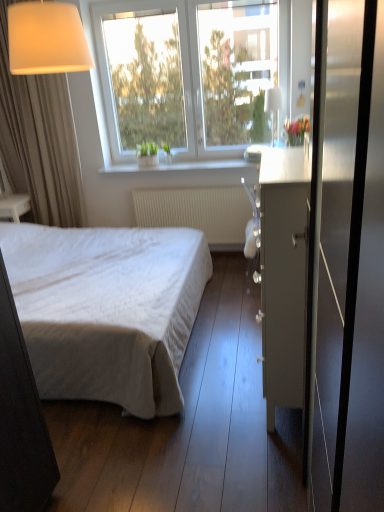
What is the approximate width of metallic glass screen door at right?

It is 5.51 inches.

Identify the location of transparent glass window at upper center. The width and height of the screenshot is (384, 512). (190, 65).

Identify the location of white quilted fabric bed at center. This screenshot has width=384, height=512. (107, 310).

Describe the element at coordinates (107, 310) in the screenshot. Image resolution: width=384 pixels, height=512 pixels. I see `white quilted fabric bed at center` at that location.

What do you see at coordinates (183, 167) in the screenshot?
I see `white smooth window sill at upper center` at bounding box center [183, 167].

What do you see at coordinates (198, 212) in the screenshot?
I see `white textured radiator at center` at bounding box center [198, 212].

Identify the location of transparent glass lamp at upper center, the second lamp viewed from the left. (272, 104).

Between matte white lampshade at upper left, acting as the 1th lamp starting from the front, and metallic glass screen door at right, which one appears on the left side from the viewer's perspective?

matte white lampshade at upper left, acting as the 1th lamp starting from the front, is more to the left.

From the picture: From the image's perspective, which one is positioned lower, matte white lampshade at upper left, which ranks as the 2th lamp in right-to-left order, or metallic glass screen door at right?

metallic glass screen door at right, from the image's perspective.

Is matte white lampshade at upper left, which is counted as the 2th lamp, starting from the back, thinner than metallic glass screen door at right?

No.

Is metallic glass screen door at right beside white textured radiator at center?

metallic glass screen door at right and white textured radiator at center are not in contact.

You are a GUI agent. You are given a task and a screenshot of the screen. Output one action in this format:
    pyautogui.click(x=<x>, y=<y>)
    Task: Click on the screen door that is in front of the white textured radiator at center
    
    Given the screenshot: What is the action you would take?
    pyautogui.click(x=359, y=212)

Which object is further away from the camera taking this photo, metallic glass screen door at right or white textured radiator at center?

Positioned behind is white textured radiator at center.

Which object is positioned more to the right, metallic glass screen door at right or white textured radiator at center?

metallic glass screen door at right is more to the right.

Looking at this image, from the image's perspective, would you say white textured radiator at center is shown under matte white lampshade at upper left, acting as the 1th lamp starting from the front?

Correct, white textured radiator at center appears lower than matte white lampshade at upper left, acting as the 1th lamp starting from the front, in the image.

From a real-world perspective, is white textured radiator at center located higher than matte white lampshade at upper left, which ranks as the 2th lamp in right-to-left order?

No.

What's the angular difference between white textured radiator at center and matte white lampshade at upper left, acting as the 1th lamp starting from the front,'s facing directions?

The facing directions of white textured radiator at center and matte white lampshade at upper left, acting as the 1th lamp starting from the front, are 11.9 degrees apart.

Between point (219, 218) and point (82, 39), which one is positioned behind?

The point (219, 218) is more distant.

Considering the sizes of transparent glass window at upper center and white smooth window sill at upper center in the image, is transparent glass window at upper center taller or shorter than white smooth window sill at upper center?

Clearly, transparent glass window at upper center is taller compared to white smooth window sill at upper center.

Does transparent glass window at upper center have a lesser width compared to white smooth window sill at upper center?

Correct, the width of transparent glass window at upper center is less than that of white smooth window sill at upper center.

Is point (195, 20) behind point (202, 170)?

No, (195, 20) is in front of (202, 170).

Is transparent glass window at upper center turned away from white smooth window sill at upper center?

No, white smooth window sill at upper center is not at the back of transparent glass window at upper center.

Is matte gray cabinet at center-right to the left or to the right of white quilted fabric bed at center in the image?

Clearly, matte gray cabinet at center-right is on the right of white quilted fabric bed at center in the image.

Measure the distance from matte gray cabinet at center-right to white quilted fabric bed at center.

matte gray cabinet at center-right and white quilted fabric bed at center are 1.04 meters apart.

Would you say matte gray cabinet at center-right contains white quilted fabric bed at center?

That's incorrect, white quilted fabric bed at center is not inside matte gray cabinet at center-right.

Which object is further away from the camera, matte gray cabinet at center-right or white quilted fabric bed at center?

Positioned behind is white quilted fabric bed at center.

How different are the orientations of matte gray cabinet at center-right and white smooth window sill at upper center in degrees?

They differ by 91 degrees in their facing directions.

Is point (278, 234) closer or farther from the camera than point (201, 169)?

Point (278, 234).

Between matte gray cabinet at center-right and white smooth window sill at upper center, which one has smaller size?

With smaller size is white smooth window sill at upper center.

Is matte gray cabinet at center-right in front of or behind white smooth window sill at upper center in the image?

Visually, matte gray cabinet at center-right is located in front of white smooth window sill at upper center.

From the image's perspective, which object appears higher, white textured radiator at center or beige fabric curtain at left?

From the image's view, beige fabric curtain at left is above.

Is white textured radiator at center thinner than beige fabric curtain at left?

Correct, the width of white textured radiator at center is less than that of beige fabric curtain at left.

Considering the relative sizes of white textured radiator at center and beige fabric curtain at left in the image provided, is white textured radiator at center taller than beige fabric curtain at left?

No, white textured radiator at center is not taller than beige fabric curtain at left.

Which is farther from the camera, (236, 207) or (37, 119)?

Positioned behind is point (236, 207).

Where is `screen door to the right of matte white lampshade at upper left, acting as the 1th lamp starting from the front`? The height and width of the screenshot is (512, 384). screen door to the right of matte white lampshade at upper left, acting as the 1th lamp starting from the front is located at coordinates (359, 212).

Where is `radiator above the metallic glass screen door at right (from the image's perspective)`? radiator above the metallic glass screen door at right (from the image's perspective) is located at coordinates pyautogui.click(x=198, y=212).

Based on their spatial positions, is metallic glass screen door at right or white quilted fabric bed at center closer to white textured radiator at center?

The object closer to white textured radiator at center is white quilted fabric bed at center.

Estimate the real-world distances between objects in this image. Which object is closer to transparent glass lamp at upper center, the second lamp viewed from the left, matte white lampshade at upper left, acting as the 1th lamp starting from the front, or beige fabric curtain at left?

Among the two, matte white lampshade at upper left, acting as the 1th lamp starting from the front, is located nearer to transparent glass lamp at upper center, the second lamp viewed from the left.

From the picture: Which object lies further to the anchor point transparent glass window at upper center, white quilted fabric bed at center or matte gray cabinet at center-right?

Based on the image, matte gray cabinet at center-right appears to be further to transparent glass window at upper center.

Which object lies nearer to the anchor point white smooth window sill at upper center, white quilted fabric bed at center or matte gray cabinet at center-right?

white quilted fabric bed at center.

Which object lies further to the anchor point beige fabric curtain at left, matte white lampshade at upper left, which is counted as the 2th lamp, starting from the back, or matte gray cabinet at center-right?

The object further to beige fabric curtain at left is matte gray cabinet at center-right.

Considering their positions, is metallic glass screen door at right positioned closer to transparent glass lamp at upper center, the 1th lamp from the right, than white textured radiator at center?

white textured radiator at center is positioned closer to the anchor transparent glass lamp at upper center, the 1th lamp from the right.

Consider the image. When comparing their distances from white smooth window sill at upper center, does matte gray cabinet at center-right or transparent glass lamp at upper center, which ranks as the first lamp in back-to-front order, seem further?

matte gray cabinet at center-right.

In the scene shown: Based on their spatial positions, is white quilted fabric bed at center or metallic glass screen door at right further from white smooth window sill at upper center?

metallic glass screen door at right is further to white smooth window sill at upper center.

At what (x,y) coordinates should I click in order to perform the action: click on bed between matte gray cabinet at center-right and transparent glass lamp at upper center, which ranks as the first lamp in back-to-front order, from front to back. Please return your answer as a coordinate pair (x, y). The image size is (384, 512). Looking at the image, I should click on (107, 310).

Image resolution: width=384 pixels, height=512 pixels. I want to click on bed positioned between metallic glass screen door at right and matte white lampshade at upper left, the 1th lamp from the left, from near to far, so click(x=107, y=310).

Locate an element on the screen. The image size is (384, 512). radiator between beige fabric curtain at left and transparent glass lamp at upper center, the 1th lamp from the right, from left to right is located at coordinates (198, 212).

Find the location of a particular element. cabinetry between matte white lampshade at upper left, the 1th lamp from the left, and metallic glass screen door at right vertically is located at coordinates tap(283, 276).